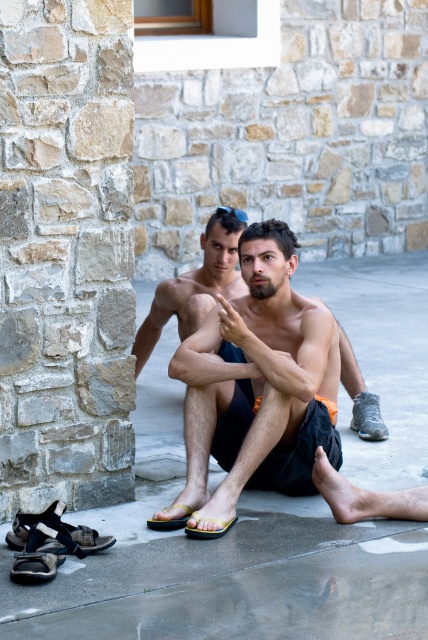
You are standing at the edge of the gray concrete pavement at center and want to kick a small pebble towards the white mesh sneaker at lower right. In which direction should you kick the pebble?

Since the gray concrete pavement at center is located below the white mesh sneaker at lower right, you should kick the pebble upward to reach the white mesh sneaker at lower right.

You are standing in front of the gray concrete pavement at center and the yellow matte sandal at lower center. Which object is located to the right of the other?

The gray concrete pavement at center is positioned on the right side of yellow matte sandal at lower center.

You are designing a small garden and need to place a decorative stone that is 15 cm in diameter. Given the gray concrete pavement at center and the yellow fabric sandal at lower center, which surface can accommodate the stone without it overhanging?

The gray concrete pavement at center has a larger size compared to yellow fabric sandal at lower center, so the decorative stone can be placed on the gray concrete pavement at center without overhanging.